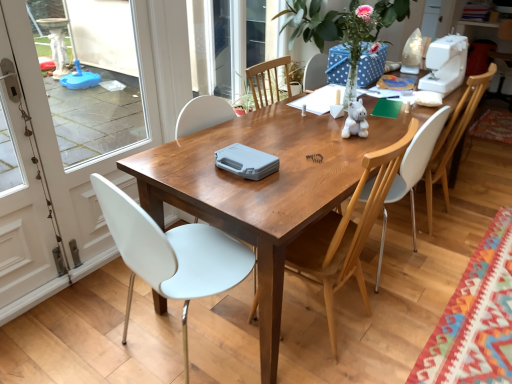
This screenshot has height=384, width=512. Identify the location of free area in between white plastic chair at center, marked as the second chair in a right-to-left arrangement, and multicolored woven mat at lower right. (437, 273).